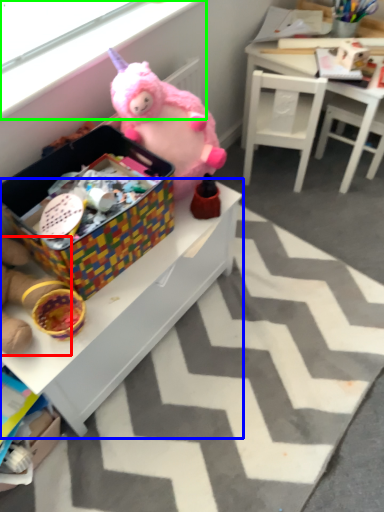
Question: Based on their relative distances, which object is farther from toy (highlighted by a red box)? Choose from table (highlighted by a blue box) and window screen (highlighted by a green box).

Choices:
 (A) table
 (B) window screen

Answer: (B)